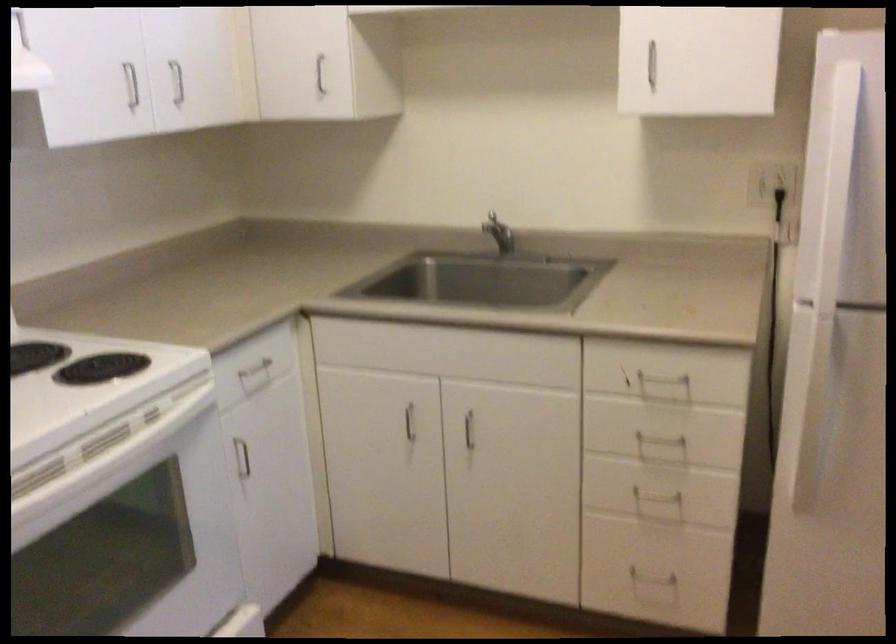
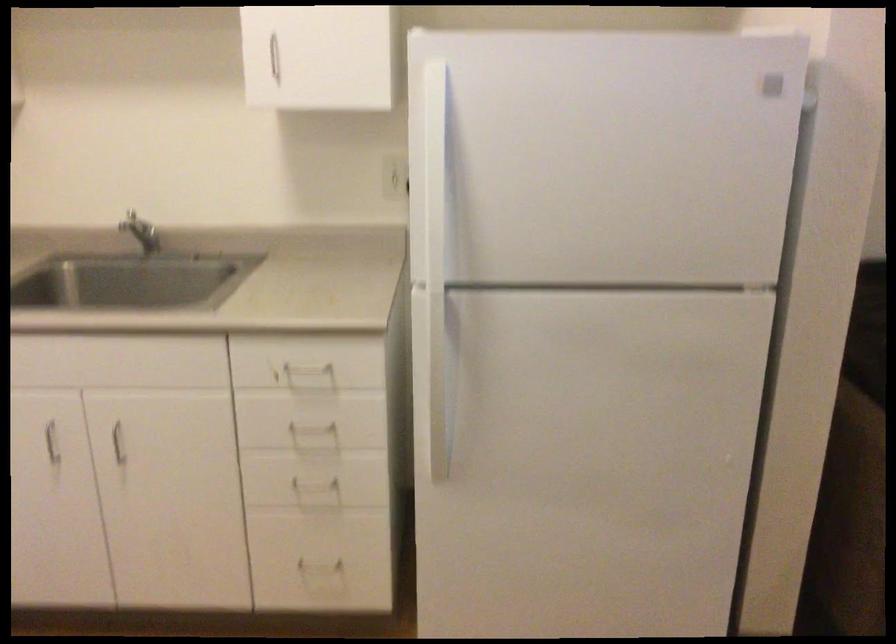
In the second image, find the point that corresponds to [648,574] in the first image.

(317, 560)